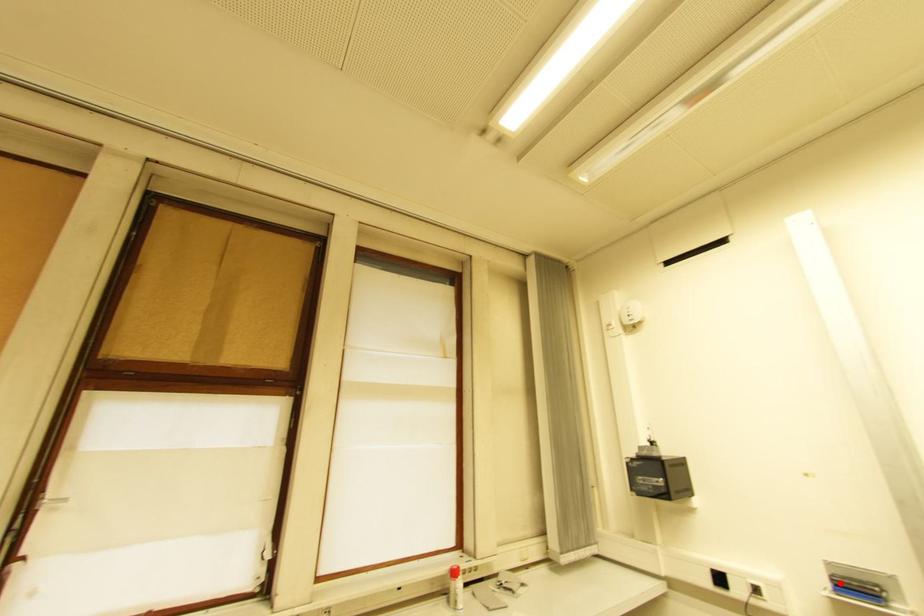
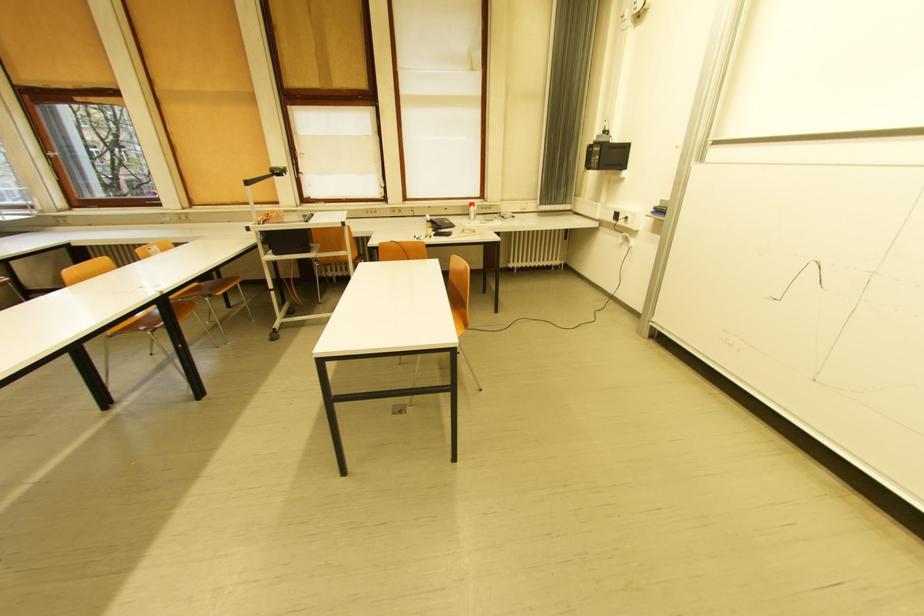
In the second image, find the point that corresponds to the highlighted location in the first image.

(662, 209)